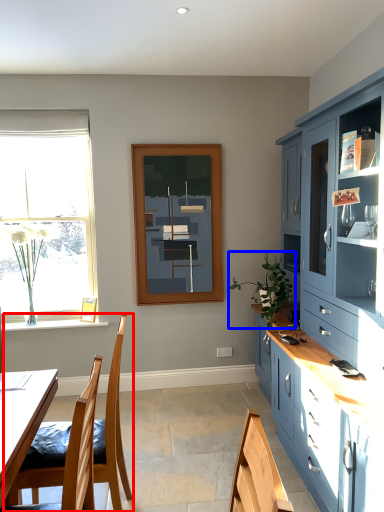
Question: Which object appears closest to the camera in this image, chair (highlighted by a red box) or houseplant (highlighted by a blue box)?

Choices:
 (A) chair
 (B) houseplant

Answer: (A)